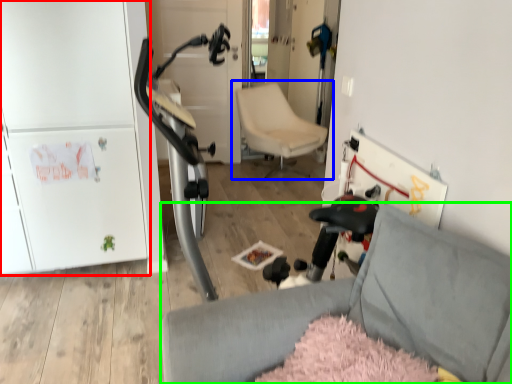
Question: Which object is positioned farthest from fridge (highlighted by a red box)? Select from chair (highlighted by a blue box) and chair (highlighted by a green box).

Choices:
 (A) chair
 (B) chair

Answer: (A)